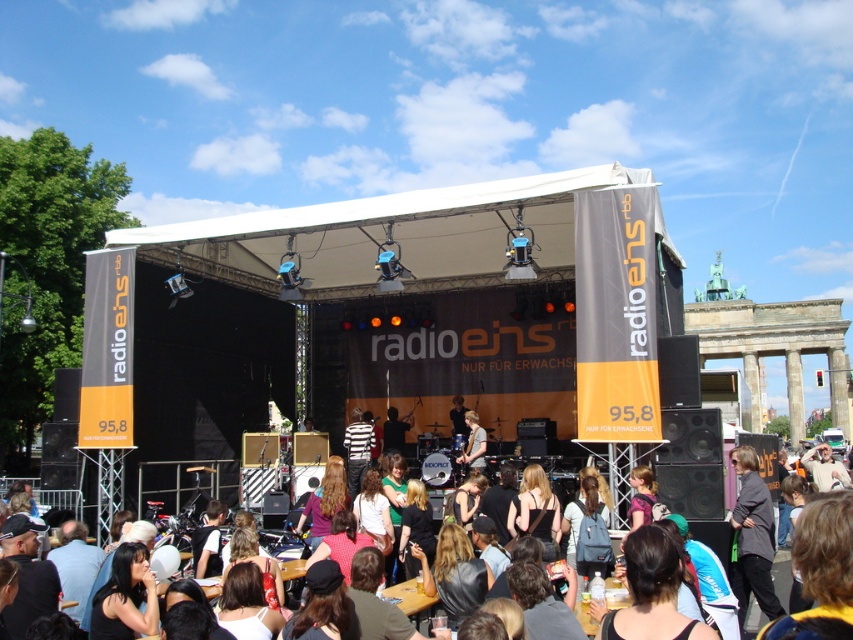
Between shiny silver guitar at center and matte black guitar at center, which one is positioned lower?

matte black guitar at center is below.

Measure the distance between shiny silver guitar at center and matte black guitar at center.

shiny silver guitar at center is 16.26 meters away from matte black guitar at center.

This screenshot has height=640, width=853. What do you see at coordinates (473, 444) in the screenshot?
I see `shiny silver guitar at center` at bounding box center [473, 444].

At what (x,y) coordinates should I click in order to perform the action: click on shiny silver guitar at center. Please return your answer as a coordinate pair (x, y). The width and height of the screenshot is (853, 640). Looking at the image, I should click on tap(473, 444).

Between point (767, 502) and point (471, 467), which one is positioned in front?

Point (767, 502)

Which is below, dark gray fabric jacket at lower right or shiny silver guitar at center?

dark gray fabric jacket at lower right is below.

Is point (764, 486) farther from viewer compared to point (471, 422)?

No, (764, 486) is in front of (471, 422).

In order to click on dark gray fabric jacket at lower right in this screenshot , I will do `click(752, 538)`.

Can you confirm if dark gray fabric jacket at lower right is positioned to the left of matte black jacket at center?

No, dark gray fabric jacket at lower right is not to the left of matte black jacket at center.

This screenshot has width=853, height=640. What are the coordinates of `dark gray fabric jacket at lower right` in the screenshot? It's located at 752,538.

Between point (744, 618) and point (463, 412), which one is positioned in front?

Point (744, 618) is more forward.

The width and height of the screenshot is (853, 640). Identify the location of dark gray fabric jacket at lower right. (752, 538).